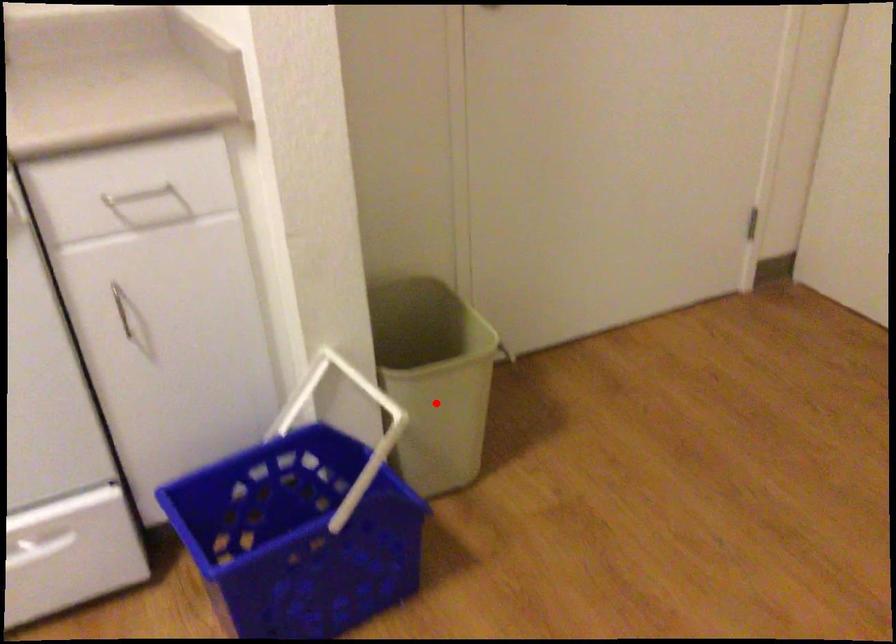
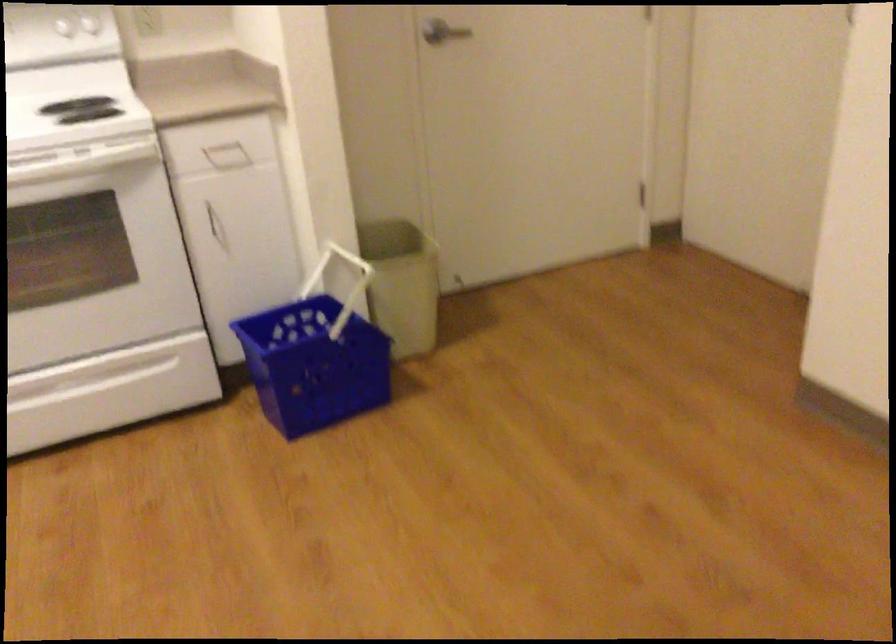
Question: A red point is marked in image1. In image2, is the corresponding 3D point closer to the camera or farther? Reply with the corresponding letter.

Choices:
 (A) The corresponding 3D point is closer.
 (B) The corresponding 3D point is farther.

Answer: (B)